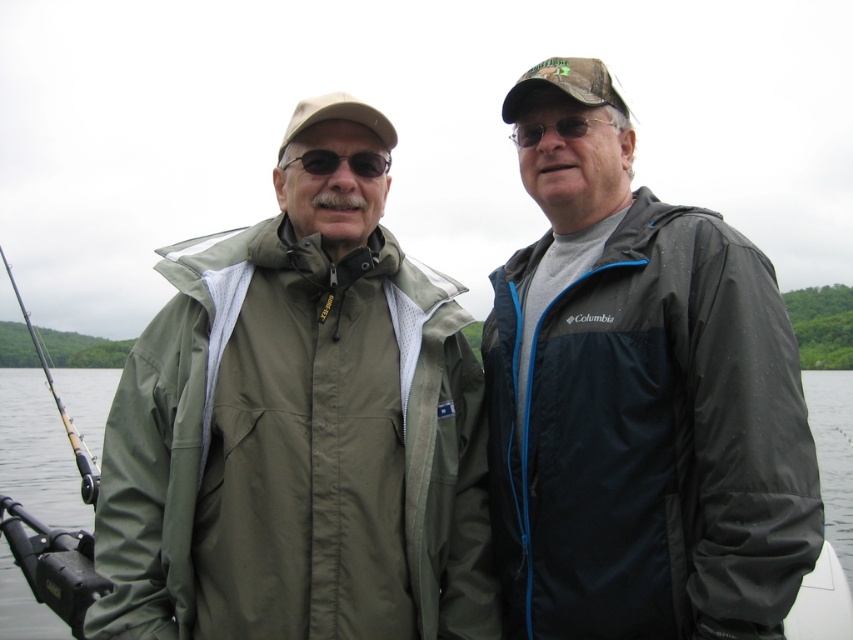
Between matte black fishing pole at left and matte black sunglasses at center, which one is positioned higher?

matte black fishing pole at left

The width and height of the screenshot is (853, 640). In order to click on matte black fishing pole at left in this screenshot , I will do `click(61, 406)`.

Does point (90, 461) come farther from viewer compared to point (386, 154)?

Yes, point (90, 461) is farther from viewer.

This screenshot has width=853, height=640. What are the coordinates of `matte black fishing pole at left` in the screenshot? It's located at (61, 406).

Who is more distant from viewer, [320,205] or [846,376]?

The point [846,376] is more distant.

Who is lower down, olive green fabric jacket at left or transparent water at center?

transparent water at center is lower down.

Who is more forward, (241, 243) or (33, 474)?

Point (241, 243)

Locate an element on the screen. Image resolution: width=853 pixels, height=640 pixels. olive green fabric jacket at left is located at coordinates (299, 438).

Is matte black sunglasses at center taller than matte black sunglasses at upper center?

Correct, matte black sunglasses at center is much taller as matte black sunglasses at upper center.

Can you confirm if matte black sunglasses at center is positioned to the right of matte black sunglasses at upper center?

No, matte black sunglasses at center is not to the right of matte black sunglasses at upper center.

Who is more forward, (283,161) or (576,131)?

Point (576,131) is more forward.

Identify the location of matte black sunglasses at center. Image resolution: width=853 pixels, height=640 pixels. (339, 163).